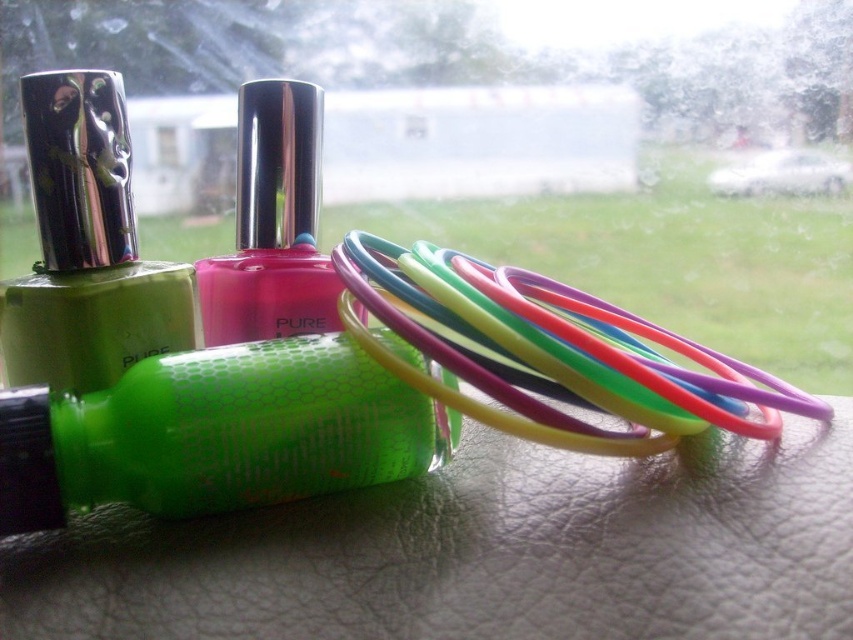
You are organizing a makeup kit and see the matte green nail polish at left and the pink glossy nail polish at center. Which one is positioned lower on the surface?

The matte green nail polish at left is positioned lower than the pink glossy nail polish at center.

You are holding a phone that is 6 inches long and want to take a photo of the neon green glossy nail polish at center. If you hold your phone at eye level, will the entire nail polish fit in the camera view without zooming? Assume the camera view is 8 inches wide.

The neon green glossy nail polish at center is 12.88 inches away from the viewer. Since the phone is 6 inches long and the camera view is 8 inches wide, the nail polish can fit within the 8 inch width when held at 12.88 inches distance. Therefore, yes, the entire nail polish will fit in the camera view without zooming.

You are a customer at a beauty store and want to pick up the matte green nail polish at left and the pink glossy nail polish at center. Which one do you need to reach over first?

You need to reach over the matte green nail polish at left first because it is closer to you than the pink glossy nail polish at center.